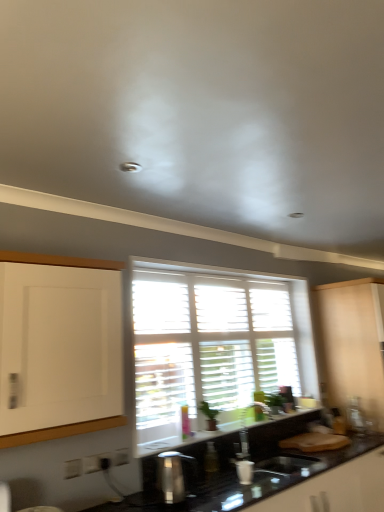
Identify the location of vacant point to the right of metallic silver soap dispenser at lower center, marked as the first appliance in a left-to-right arrangement. The height and width of the screenshot is (512, 384). (220, 499).